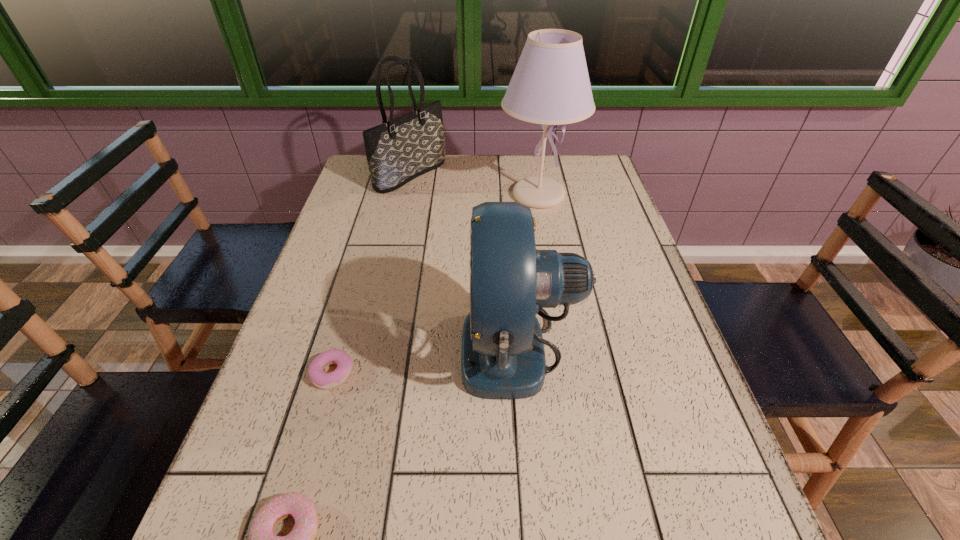
This screenshot has width=960, height=540. I want to click on the second closest object to the tallest object, so click(502, 353).

You are a GUI agent. You are given a task and a screenshot of the screen. Output one action in this format:
    pyautogui.click(x=<x>, y=<y>)
    Task: Click on the free spot that satisfies the following two spatial constraints: 1. on the front side of the lampshade; 2. on the right side of the tote bag
    Image resolution: width=960 pixels, height=540 pixels.
    Given the screenshot: What is the action you would take?
    pyautogui.click(x=406, y=195)